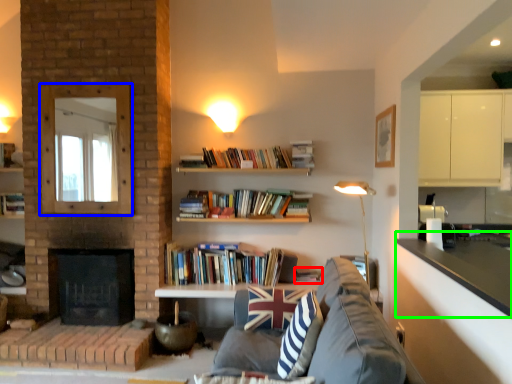
Question: Based on their relative distances, which object is nearer to book (highlighted by a red box)? Choose from mirror (highlighted by a blue box) and counter top (highlighted by a green box).

Choices:
 (A) mirror
 (B) counter top

Answer: (B)